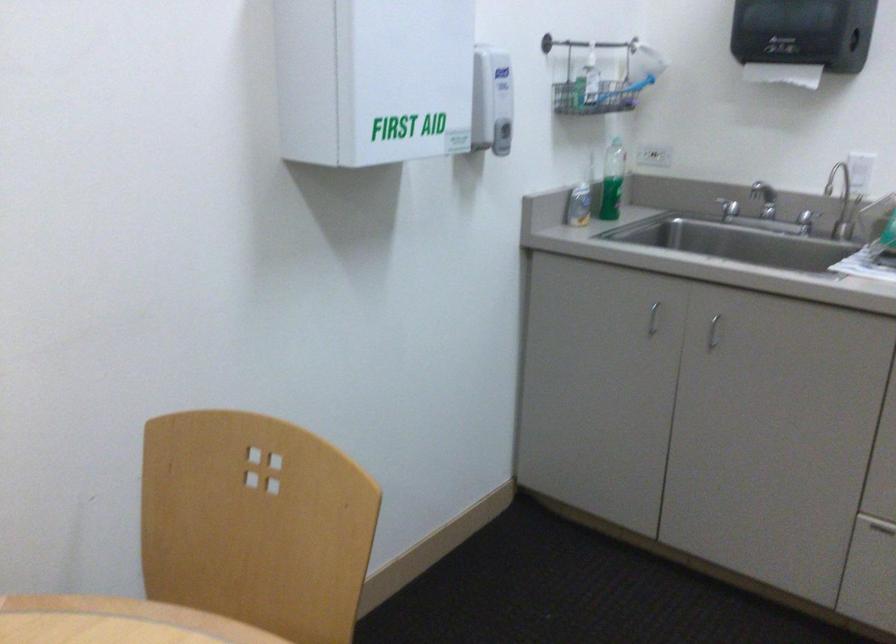
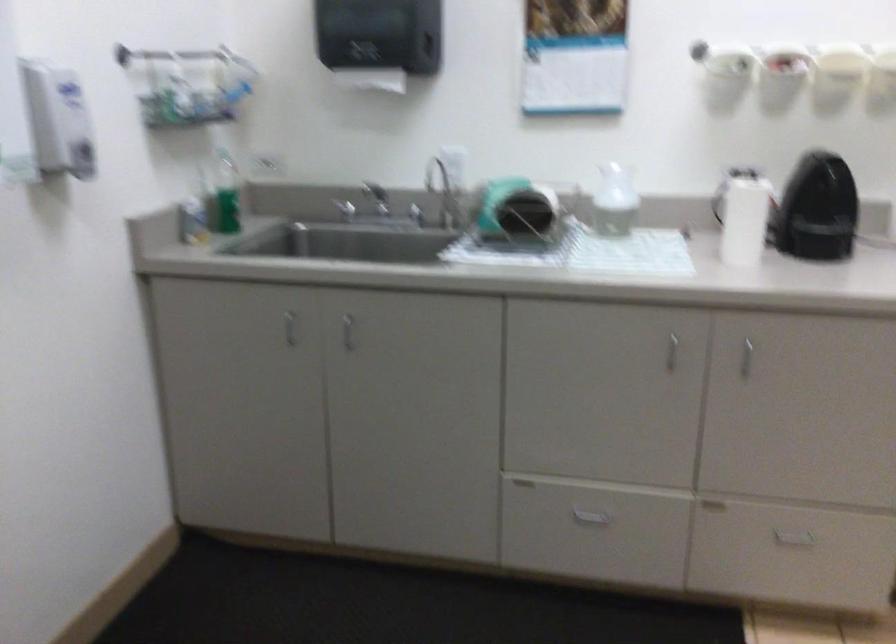
Question: How did the camera likely rotate?

Choices:
 (A) Left
 (B) Right
 (C) Up
 (D) Down

Answer: (B)